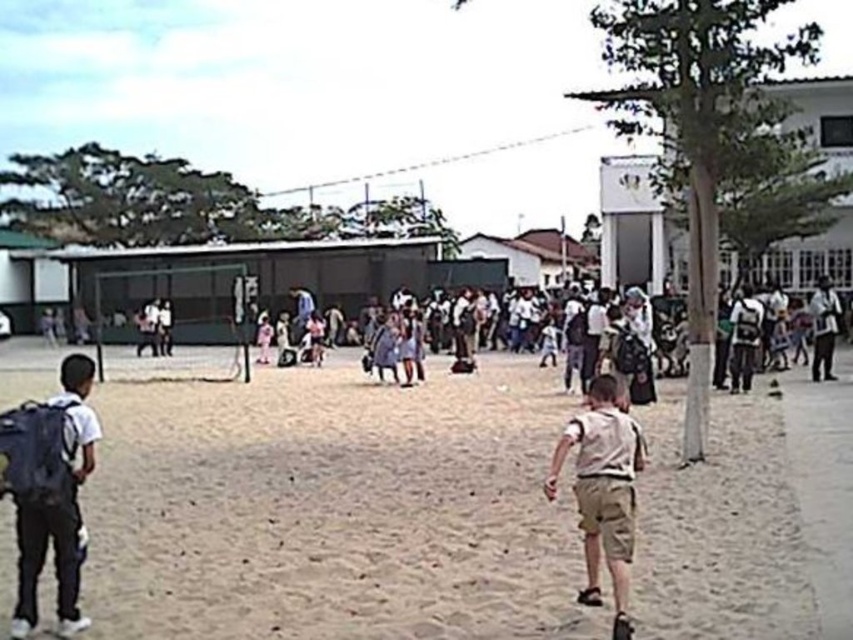
You are a parent looking for your child in the schoolyard. You see the black fabric backpack at left and the khaki shorts at center. Which item is closer to the ground?

The black fabric backpack at left is shorter than the khaki shorts at center, so the backpack is closer to the ground.

Consider the image. You are standing in the schoolyard and want to place a new bench between the brown sandy dirt field at center and the black fabric backpack at left. Based on their positions, which side of the backpack should the bench be placed to ensure it aligns with the existing field?

The bench should be placed to the right side of the black fabric backpack at left because the brown sandy dirt field at center is already positioned on the right side of the backpack.

You are a parent trying to locate your child in the schoolyard. You see the brown sandy dirt field at center and the black fabric backpack at left. Which object is wider?

The brown sandy dirt field at center is wider than the black fabric backpack at left.